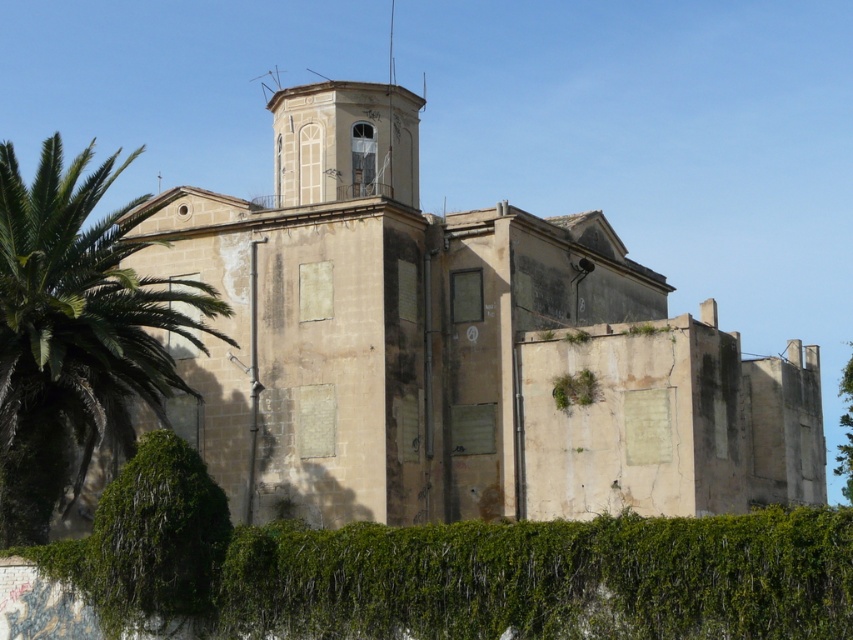
You are a drone operator trying to capture a photo of the white painted stone bell tower at upper center from above the green leafy hedge at lower center. The drone has a maximum flight distance of 25 meters. Can the drone reach the bell tower from the hedge without exceeding its range?

The green leafy hedge at lower center and white painted stone bell tower at upper center are 26.10 meters apart, which exceeds the drone maximum flight distance of 25 meters. The drone cannot reach the bell tower from the hedge without exceeding its range.

You are standing in front of the old building and want to take a photo of both the green leafy hedge at lower center and the white painted stone bell tower at upper center. Which object should you adjust your camera to focus on first if you want to include both in the frame?

The green leafy hedge at lower center is positioned on the right side of the white painted stone bell tower at upper center, so you should focus on the white painted stone bell tower at upper center first to ensure both are in the frame.

You are standing at the entrance of the old building and see two points marked on the facade. The first point is at coordinate point (125, 605) and the second is at point (849, 368). Which point is closer to you?

Point (125, 605) is closer to you because it is in front of point (849, 368).